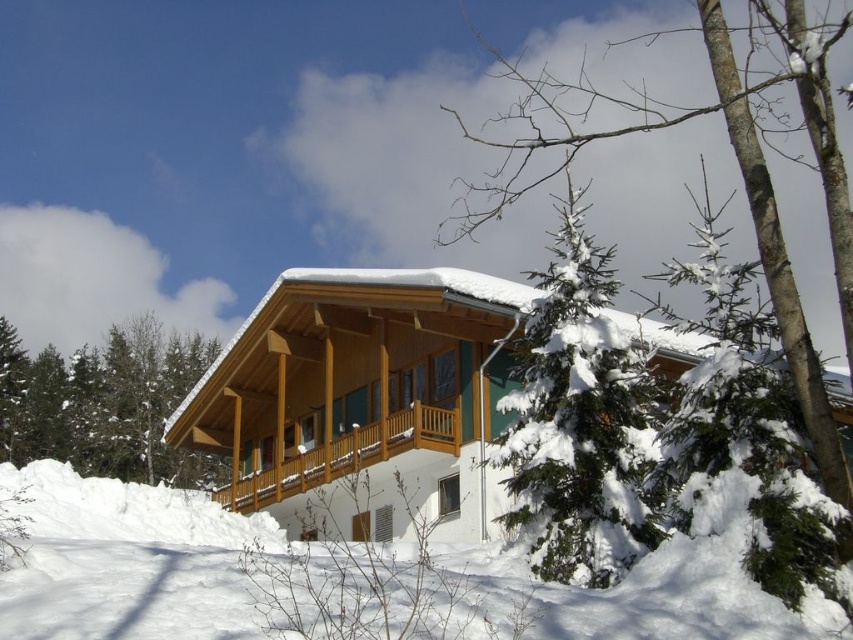
Is point (27, 557) positioned after point (817, 376)?

No, (27, 557) is in front of (817, 376).

Does white fluffy snow at lower center appear over snow-covered evergreen at center?

Actually, white fluffy snow at lower center is below snow-covered evergreen at center.

Where is `white fluffy snow at lower center`? This screenshot has width=853, height=640. white fluffy snow at lower center is located at coordinates (126, 561).

Can you confirm if wooden cabin at center is taller than green needle-like tree at center?

No, wooden cabin at center is not taller than green needle-like tree at center.

Does wooden cabin at center have a smaller size compared to green needle-like tree at center?

Yes, wooden cabin at center is smaller than green needle-like tree at center.

Locate an element on the screen. wooden cabin at center is located at coordinates [x=360, y=390].

Based on the photo, who is higher up, wooden cabin at center or white fluffy snow at lower center?

wooden cabin at center is higher up.

Which is more to the left, wooden cabin at center or white fluffy snow at lower center?

white fluffy snow at lower center is more to the left.

Which is behind, point (252, 400) or point (196, 624)?

Positioned behind is point (252, 400).

At what (x,y) coordinates should I click in order to perform the action: click on wooden cabin at center. Please return your answer as a coordinate pair (x, y). Looking at the image, I should click on (360, 390).